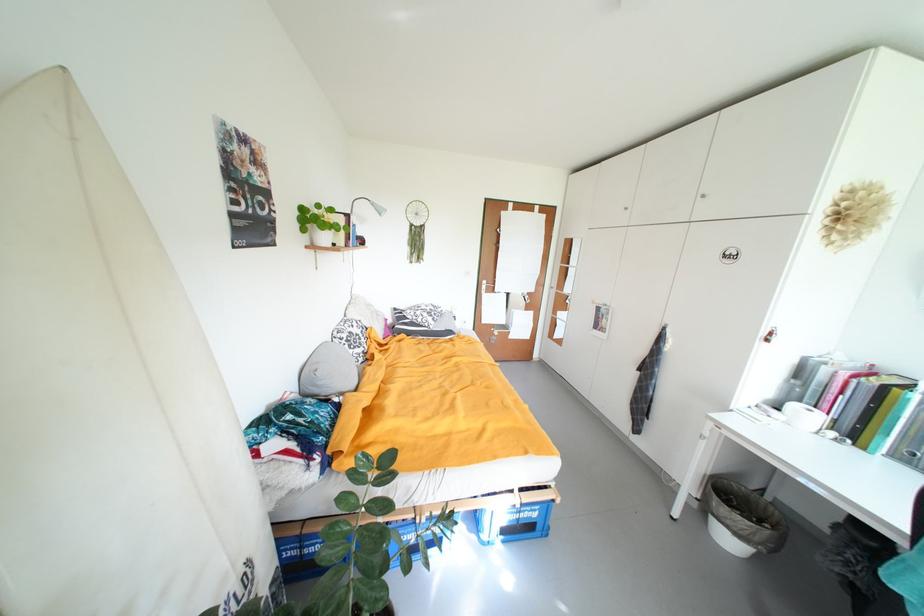
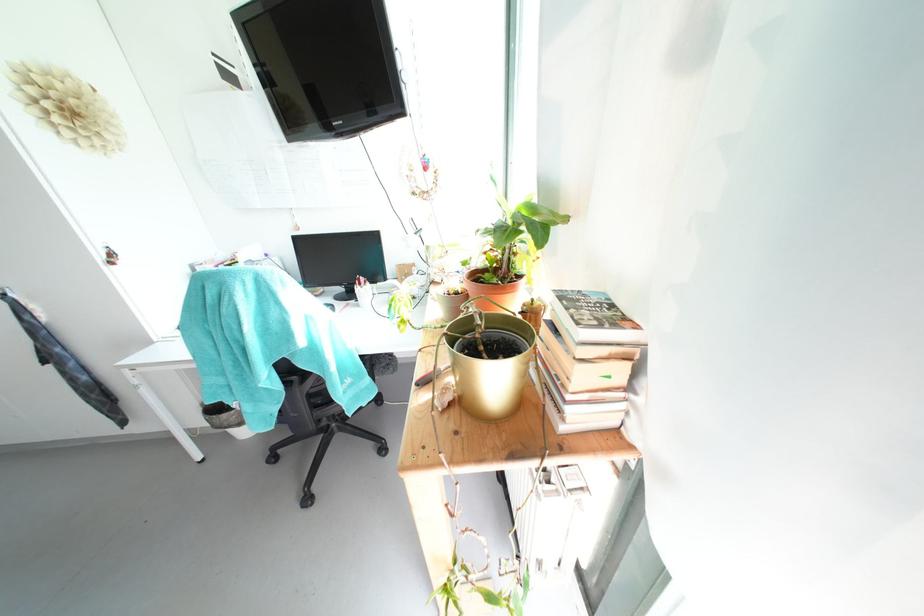
First-person continuous shooting, in which direction is the camera rotating?

The camera rotated toward right-down.